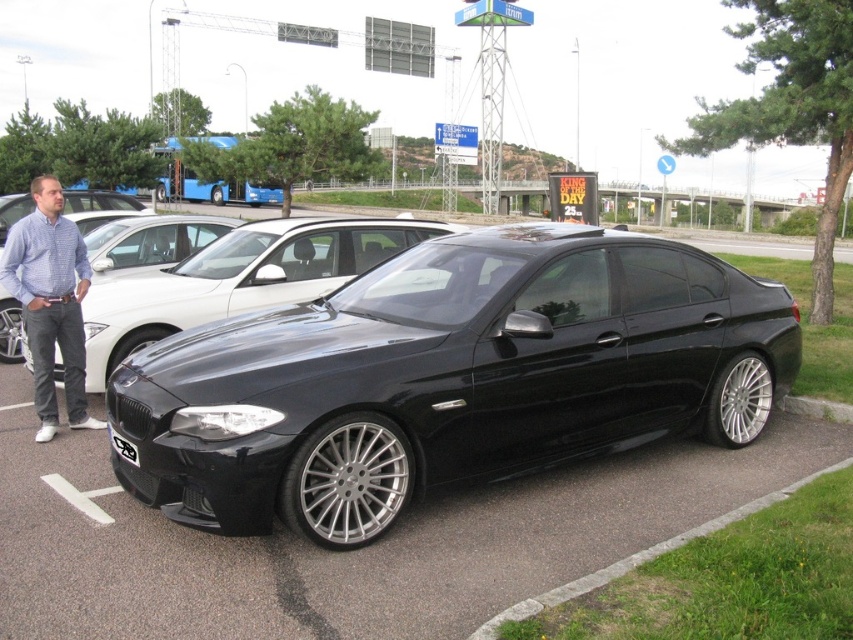
Is glossy black car at center bigger than blue checkered shirt at left?

Actually, glossy black car at center might be smaller than blue checkered shirt at left.

Between point (259, 436) and point (38, 300), which one is positioned in front?

Point (259, 436)

Which is in front, point (619, 384) or point (6, 260)?

Point (619, 384)

This screenshot has height=640, width=853. What are the coordinates of `glossy black car at center` in the screenshot? It's located at (447, 378).

Is point (390, 278) farther from viewer compared to point (61, 360)?

That is False.

Does point (231, 460) lie in front of point (114, 298)?

Yes, it is.

Who is more forward, (x=560, y=314) or (x=167, y=276)?

Point (x=560, y=314) is more forward.

Where is `glossy black car at center`? Image resolution: width=853 pixels, height=640 pixels. glossy black car at center is located at coordinates (447, 378).

Can you confirm if glossy black car at center is taller than black plastic license plate at center?

Correct, glossy black car at center is much taller as black plastic license plate at center.

What do you see at coordinates (447, 378) in the screenshot? Image resolution: width=853 pixels, height=640 pixels. I see `glossy black car at center` at bounding box center [447, 378].

Is point (364, 492) positioned behind point (109, 429)?

No, it is in front of (109, 429).

You are a GUI agent. You are given a task and a screenshot of the screen. Output one action in this format:
    pyautogui.click(x=<x>, y=<y>)
    Task: Click on the glossy black car at center
    
    Given the screenshot: What is the action you would take?
    pyautogui.click(x=447, y=378)